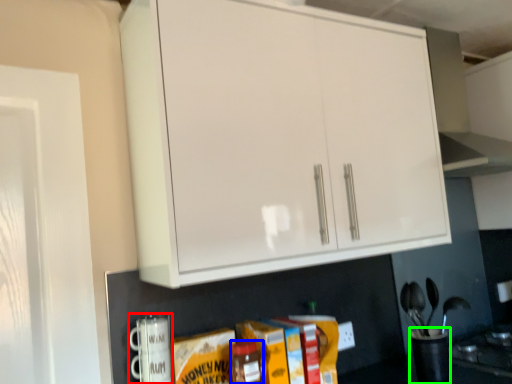
Question: Estimate the real-world distances between objects in this image. Which object is farther from appliance (highlighted by a red box), bottle (highlighted by a blue box) or appliance (highlighted by a green box)?

Choices:
 (A) bottle
 (B) appliance

Answer: (B)